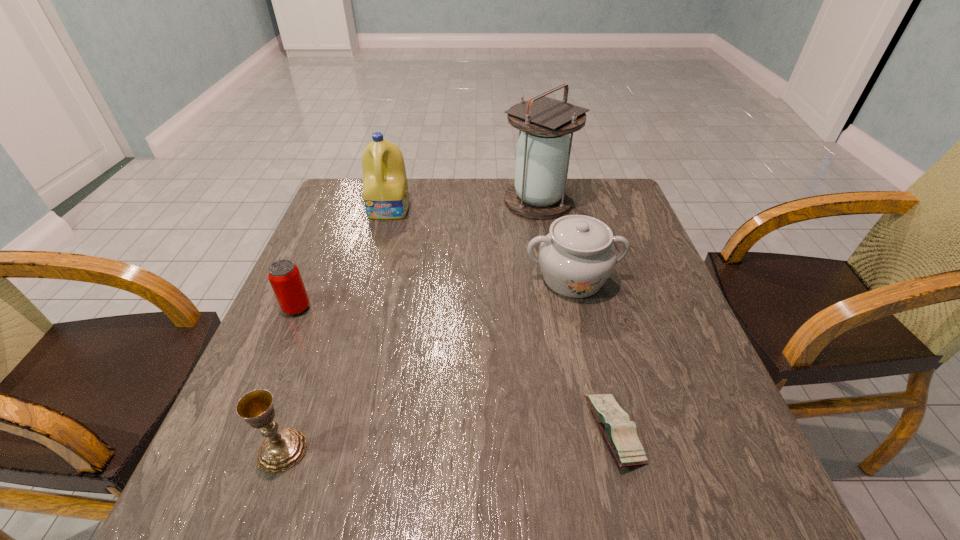
Locate an element on the screen. object that is positioned at the right edge is located at coordinates (576, 258).

Where is `object that is at the far left corner`? This screenshot has width=960, height=540. object that is at the far left corner is located at coordinates (385, 190).

The height and width of the screenshot is (540, 960). I want to click on object located at the near left corner, so [282, 449].

This screenshot has width=960, height=540. In the image, there is a desktop. What are the coordinates of `vacant space at the far edge` in the screenshot? It's located at 427,191.

You are a GUI agent. You are given a task and a screenshot of the screen. Output one action in this format:
    pyautogui.click(x=<x>, y=<y>)
    Task: Click on the free space at the near edge of the desktop
    This screenshot has height=540, width=960.
    Given the screenshot: What is the action you would take?
    pyautogui.click(x=364, y=488)

This screenshot has width=960, height=540. Identify the location of vacant region at the left edge of the desktop. (315, 278).

Find the location of a particular element. vacant space at the right edge of the desktop is located at coordinates [x=708, y=397].

Find the location of `vacant space at the far left corner of the desktop`. vacant space at the far left corner of the desktop is located at coordinates (357, 218).

This screenshot has height=540, width=960. Identify the location of vacant area at the near left corner of the desktop. (194, 523).

Where is `free space at the far right corner of the desktop`? Image resolution: width=960 pixels, height=540 pixels. free space at the far right corner of the desktop is located at coordinates (622, 199).